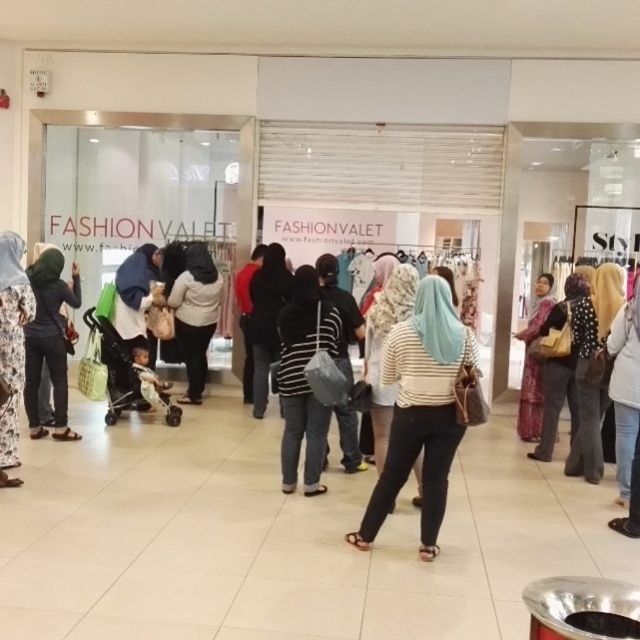
Between point (4, 330) and point (406, 312), which one is positioned behind?

The point (4, 330) is more distant.

Can you confirm if floral printed hijab at left is positioned to the left of striped fabric at center?

Correct, you'll find floral printed hijab at left to the left of striped fabric at center.

Does point (8, 308) come closer to viewer compared to point (416, 481)?

Yes, it is in front of point (416, 481).

In order to click on floral printed hijab at left in this screenshot , I will do `click(12, 346)`.

Can you confirm if striped fabric bag at center is wider than floral printed hijab at left?

Correct, the width of striped fabric bag at center exceeds that of floral printed hijab at left.

Does striped fabric bag at center have a lesser width compared to floral printed hijab at left?

No, striped fabric bag at center is not thinner than floral printed hijab at left.

Is point (328, 422) closer to camera compared to point (0, 460)?

That is False.

Locate an element on the screen. The image size is (640, 640). striped fabric bag at center is located at coordinates (304, 380).

Is white matte coat at center bigger than striped fabric at center?

No.

Where is `white matte coat at center`? This screenshot has width=640, height=640. white matte coat at center is located at coordinates (195, 314).

The image size is (640, 640). I want to click on white matte coat at center, so click(195, 314).